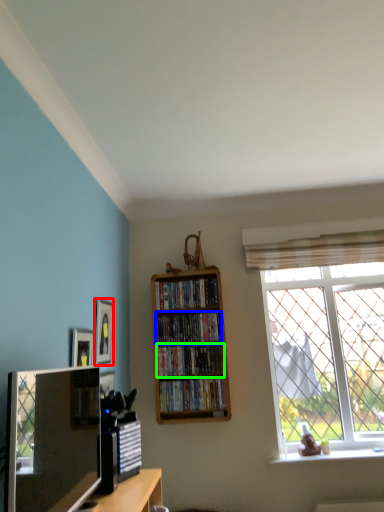
Question: Which is farther away from picture frame (highlighted by a red box)? book (highlighted by a blue box) or book (highlighted by a green box)?

Choices:
 (A) book
 (B) book

Answer: (B)